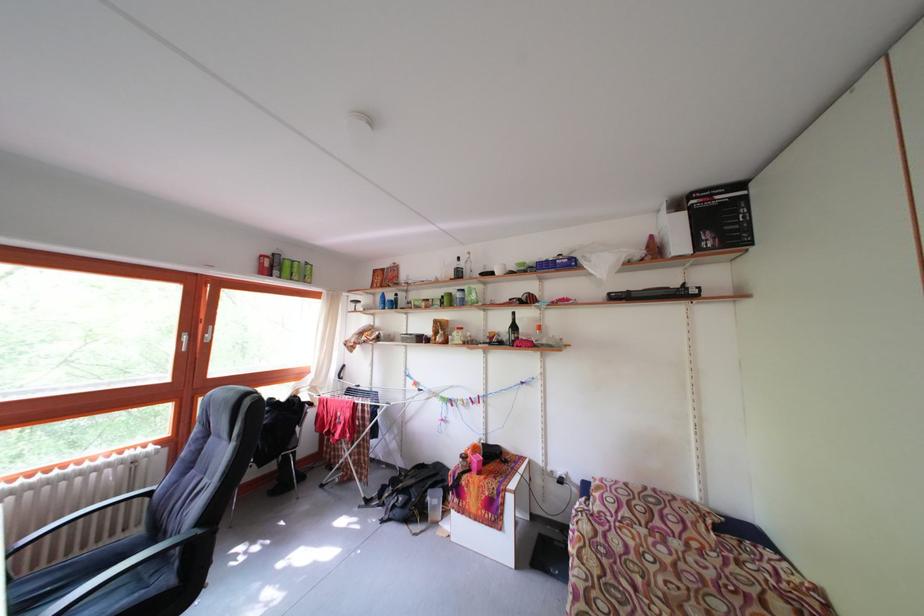
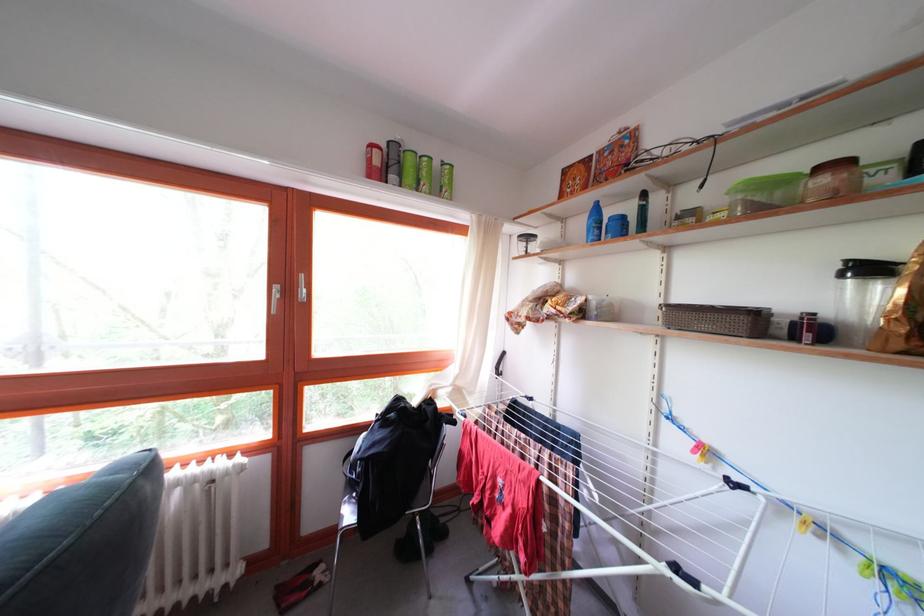
In the second image, find the point that corresponds to (388,297) in the first image.

(598, 204)